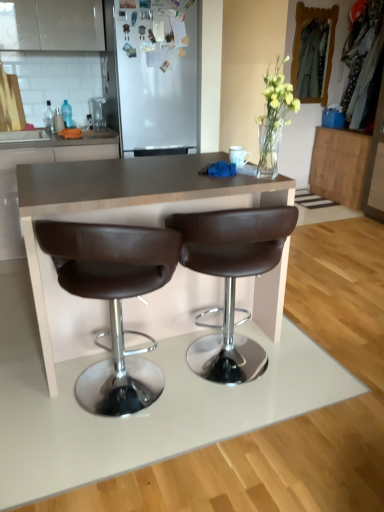
Question: Considering the relative positions of wooden cabinet at right, placed as the 2th cabinetry when sorted from left to right, and brown leather cabinet at center, arranged as the 1th cabinetry when viewed from the front, in the image provided, is wooden cabinet at right, placed as the 2th cabinetry when sorted from left to right, to the right of brown leather cabinet at center, arranged as the 1th cabinetry when viewed from the front, from the viewer's perspective?

Choices:
 (A) no
 (B) yes

Answer: (B)

Question: Is wooden cabinet at right, placed as the 2th cabinetry when sorted from left to right, turned away from brown leather cabinet at center, placed as the 2th cabinetry when sorted from back to front?

Choices:
 (A) no
 (B) yes

Answer: (A)

Question: Does wooden cabinet at right, placed as the 2th cabinetry when sorted from left to right, turn towards brown leather cabinet at center, arranged as the 1th cabinetry when viewed from the front?

Choices:
 (A) yes
 (B) no

Answer: (A)

Question: Considering the relative sizes of wooden cabinet at right, placed as the 2th cabinetry when sorted from left to right, and brown leather cabinet at center, arranged as the 1th cabinetry when viewed from the front, in the image provided, is wooden cabinet at right, placed as the 2th cabinetry when sorted from left to right, bigger than brown leather cabinet at center, arranged as the 1th cabinetry when viewed from the front,?

Choices:
 (A) no
 (B) yes

Answer: (A)

Question: Is wooden cabinet at right, which ranks as the first cabinetry in right-to-left order, far from brown leather cabinet at center, acting as the 1th cabinetry starting from the left?

Choices:
 (A) no
 (B) yes

Answer: (B)

Question: Does point tap(249, 373) appear closer or farther from the camera than point tap(130, 59)?

Choices:
 (A) farther
 (B) closer

Answer: (B)

Question: In terms of width, does brown leather stool at center, the 2th chair positioned from the left, look wider or thinner when compared to white matte refrigerator at upper center?

Choices:
 (A) thin
 (B) wide

Answer: (A)

Question: From a real-world perspective, is brown leather stool at center, arranged as the 1th chair when viewed from the right, above or below white matte refrigerator at upper center?

Choices:
 (A) below
 (B) above

Answer: (A)

Question: Looking at the image, does brown leather stool at center, the 2th chair positioned from the left, seem bigger or smaller compared to white matte refrigerator at upper center?

Choices:
 (A) big
 (B) small

Answer: (B)

Question: Considering their positions, is brown leather stool at center, the 2th chair positioned from the left, located in front of or behind brown leather stool at center, acting as the second chair starting from the right?

Choices:
 (A) behind
 (B) front

Answer: (A)

Question: From the image's perspective, is brown leather stool at center, arranged as the 1th chair when viewed from the right, located above or below brown leather stool at center, positioned as the first chair in left-to-right order?

Choices:
 (A) above
 (B) below

Answer: (A)

Question: Is point (210, 359) closer or farther from the camera than point (117, 365)?

Choices:
 (A) farther
 (B) closer

Answer: (A)

Question: In terms of height, does brown leather stool at center, arranged as the 1th chair when viewed from the right, look taller or shorter compared to brown leather stool at center, positioned as the first chair in left-to-right order?

Choices:
 (A) short
 (B) tall

Answer: (B)

Question: Do you think wooden cabinet at right, which ranks as the 2th cabinetry in front-to-back order, is within white matte refrigerator at upper center, or outside of it?

Choices:
 (A) inside
 (B) outside

Answer: (B)

Question: Is wooden cabinet at right, which ranks as the 2th cabinetry in front-to-back order, bigger or smaller than white matte refrigerator at upper center?

Choices:
 (A) small
 (B) big

Answer: (A)